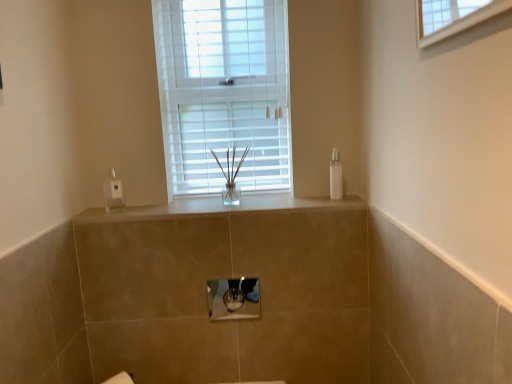
Question: Can you confirm if clear plastic soap dispenser at left is smaller than metallic silver medicine cabinet at center?

Choices:
 (A) yes
 (B) no

Answer: (A)

Question: From a real-world perspective, is clear plastic soap dispenser at left physically below metallic silver medicine cabinet at center?

Choices:
 (A) no
 (B) yes

Answer: (A)

Question: Can you confirm if clear plastic soap dispenser at left is wider than metallic silver medicine cabinet at center?

Choices:
 (A) yes
 (B) no

Answer: (A)

Question: Does clear plastic soap dispenser at left have a lesser width compared to metallic silver medicine cabinet at center?

Choices:
 (A) yes
 (B) no

Answer: (B)

Question: Is clear plastic soap dispenser at left far away from metallic silver medicine cabinet at center?

Choices:
 (A) no
 (B) yes

Answer: (A)

Question: Is metallic silver medicine cabinet at center completely or partially inside clear plastic soap dispenser at left?

Choices:
 (A) no
 (B) yes

Answer: (A)

Question: Is metallic silver medicine cabinet at center wider than satin beige countertop at center?

Choices:
 (A) yes
 (B) no

Answer: (B)

Question: Is metallic silver medicine cabinet at center looking in the opposite direction of satin beige countertop at center?

Choices:
 (A) no
 (B) yes

Answer: (A)

Question: Is metallic silver medicine cabinet at center facing towards satin beige countertop at center?

Choices:
 (A) no
 (B) yes

Answer: (A)

Question: From a real-world perspective, is metallic silver medicine cabinet at center on satin beige countertop at center?

Choices:
 (A) no
 (B) yes

Answer: (A)

Question: Is metallic silver medicine cabinet at center thinner than satin beige countertop at center?

Choices:
 (A) yes
 (B) no

Answer: (A)

Question: Is metallic silver medicine cabinet at center closer to camera compared to satin beige countertop at center?

Choices:
 (A) no
 (B) yes

Answer: (B)

Question: From a real-world perspective, does satin beige countertop at center sit lower than clear plastic bottle at right?

Choices:
 (A) no
 (B) yes

Answer: (B)